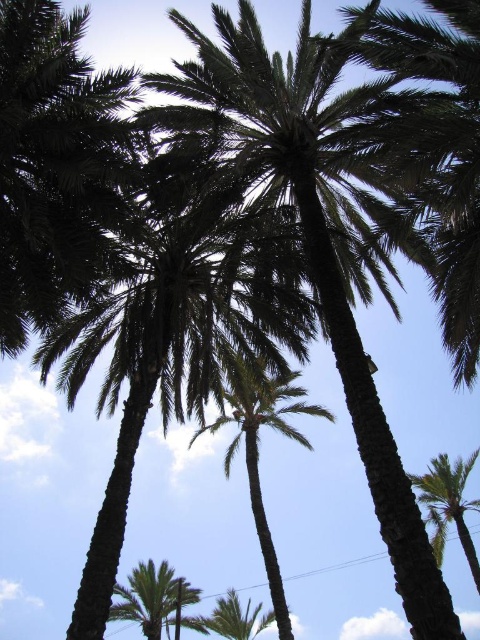
Question: Does green leafy palm tree at lower right have a larger size compared to green leafy palm tree at lower left?

Choices:
 (A) no
 (B) yes

Answer: (B)

Question: Which is nearer to the green leafy palm at center?

Choices:
 (A) green leafy palm tree at lower left
 (B) dark green leafy palm tree at center
 (C) green leafy palm tree at center

Answer: (B)

Question: Among these points, which one is farthest from the camera?

Choices:
 (A) (266, 573)
 (B) (372, 387)
 (C) (123, 428)
 (D) (146, 628)

Answer: (A)

Question: Is green leafy palm tree at lower right bigger than green leafy palm tree at lower left?

Choices:
 (A) yes
 (B) no

Answer: (A)

Question: Is dark green leafy palm tree at center closer to the viewer compared to green leafy palm tree at lower left?

Choices:
 (A) yes
 (B) no

Answer: (A)

Question: Which point is farther from the camera taking this photo?

Choices:
 (A) (100, 326)
 (B) (442, 538)
 (C) (456, 620)
 (D) (118, 605)

Answer: (D)